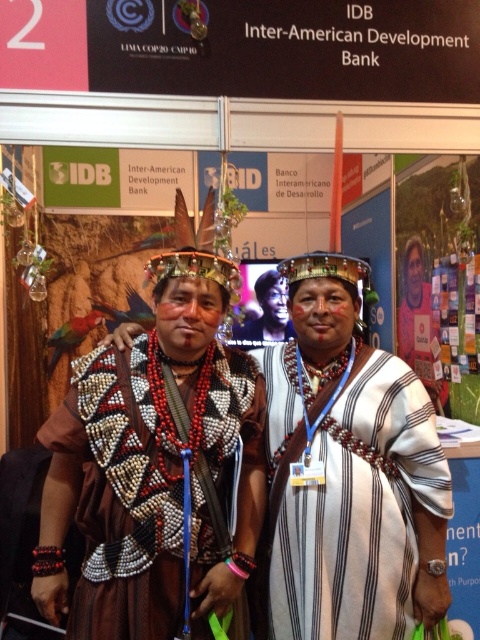
Question: Which point is closer to the camera taking this photo?

Choices:
 (A) (240, 452)
 (B) (160, 625)

Answer: (B)

Question: Is the position of matte brown feathers at center more distant than that of matte black headdress at center?

Choices:
 (A) yes
 (B) no

Answer: (B)

Question: Can you confirm if white striped fabric at center is wider than matte black headdress at center?

Choices:
 (A) no
 (B) yes

Answer: (B)

Question: Which of these objects is positioned farthest from the beaded fabric vest at center?

Choices:
 (A) matte brown feathers at center
 (B) white striped fabric at center
 (C) matte black headdress at center

Answer: (C)

Question: Which object is the closest to the beaded fabric vest at center?

Choices:
 (A) matte black headdress at center
 (B) white striped fabric at center

Answer: (B)

Question: Does matte brown feathers at center appear over white striped fabric at center?

Choices:
 (A) no
 (B) yes

Answer: (B)